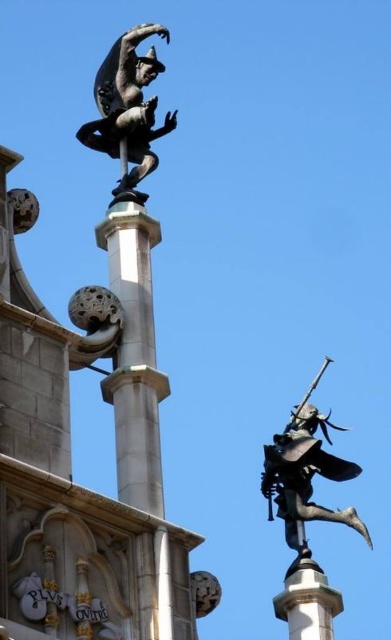
Question: Does polished bronze figure at upper left come in front of polished bronze figure at upper right?

Choices:
 (A) no
 (B) yes

Answer: (B)

Question: Which point is closer to the camera?

Choices:
 (A) (121, 112)
 (B) (340, 477)

Answer: (A)

Question: Can you confirm if polished bronze figure at upper left is bigger than polished bronze figure at upper right?

Choices:
 (A) no
 (B) yes

Answer: (B)

Question: Does polished bronze figure at upper left appear over polished bronze figure at upper right?

Choices:
 (A) yes
 (B) no

Answer: (A)

Question: Which of the following is the farthest from the observer?

Choices:
 (A) polished bronze figure at upper right
 (B) polished bronze figure at upper left

Answer: (A)